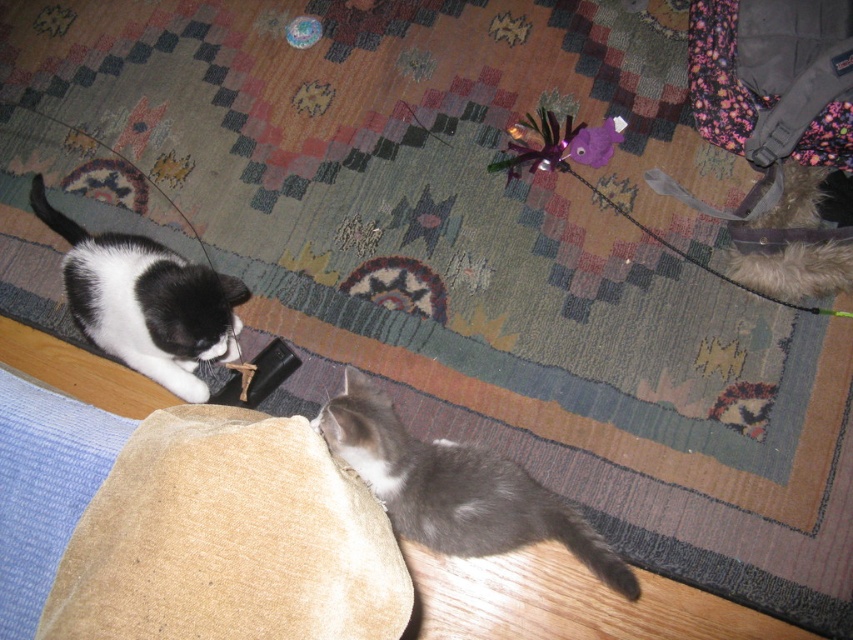
You are a photographer setting up a camera in the living room. You want to position the camera so that both the gray fluffy cat at lower right and the black matte fur cat at left are in the frame. Based on their positions, which cat should be placed closer to the left side of the camera frame?

The black matte fur cat at left should be placed closer to the left side of the camera frame because the gray fluffy cat at lower right is to the right of the black matte fur cat at left.

You are a photographer positioned at the center of the room. You want to take a photo of the gray fluffy cat at lower right. Based on its 2D coordinates, where should you aim your camera relative to the center of the image?

The gray fluffy cat at lower right is located at coordinates approximately 0.762 on the x axis and 0.535 on the y axis. Since the center of the image is at 0.5 on both axes, you should aim your camera to the right and slightly above the center point to capture the gray fluffy cat at lower right.

You are standing in the living room and want to reach the point marked at coordinates [363,403]. The distance between you and this point is 3.87 feet. If you take a step forward of 2 feet, how far will you be from the point?

After taking a 2 feet step forward, you will be 1.87 feet away from the point marked at coordinates [363,403].